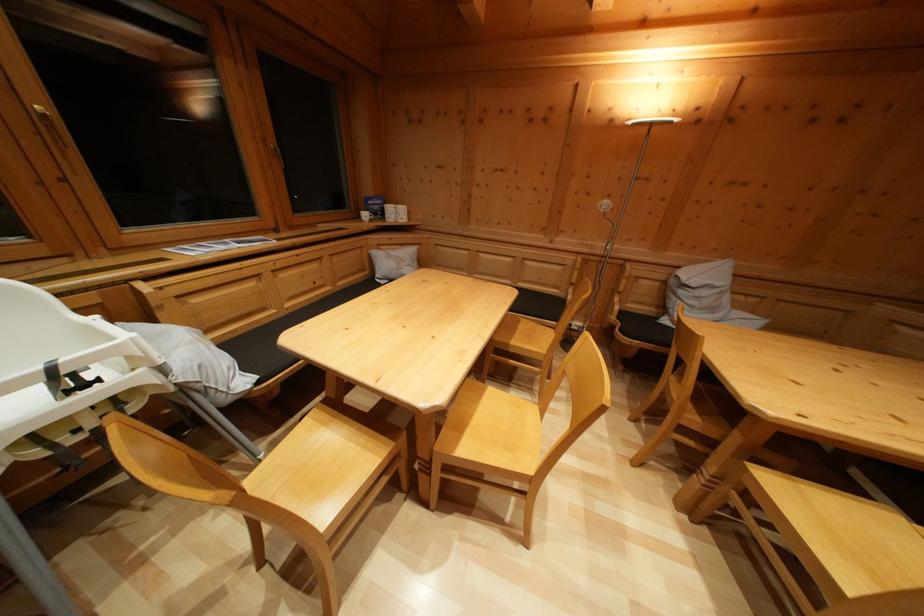
The location [217,245] corresponds to which object?

It refers to a paper booklet.